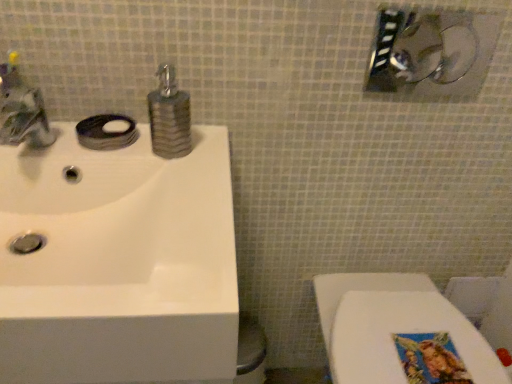
The image size is (512, 384). I want to click on free point in front of textured brown soap dispenser at center, so click(187, 188).